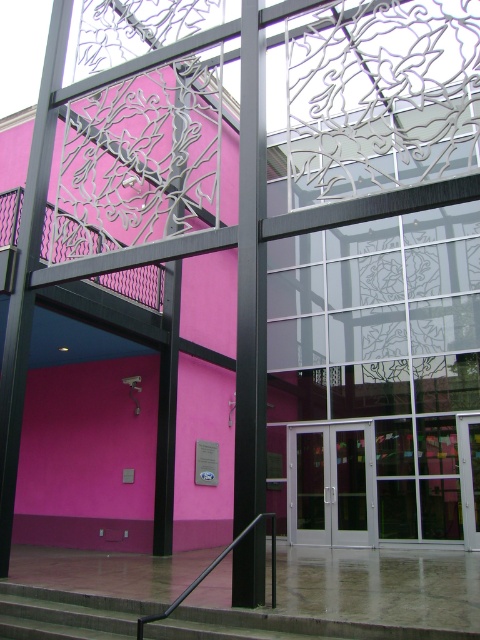
Question: Among these objects, which one is nearest to the camera?

Choices:
 (A) black metal/rail at lower center
 (B) concrete stairs at lower center
 (C) white glass door at center

Answer: (B)

Question: Is white glass door at center further to the viewer compared to black metal/rail at lower center?

Choices:
 (A) yes
 (B) no

Answer: (A)

Question: Among these objects, which one is farthest from the camera?

Choices:
 (A) white glass door at center
 (B) concrete stairs at lower center

Answer: (A)

Question: Observing the image, what is the correct spatial positioning of white glass door at center in reference to black metal/rail at lower center?

Choices:
 (A) right
 (B) left

Answer: (A)

Question: Which object is positioned farthest from the concrete stairs at lower center?

Choices:
 (A) white glass door at center
 (B) black metal/rail at lower center

Answer: (A)

Question: Observing the image, what is the correct spatial positioning of concrete stairs at lower center in reference to black metal/rail at lower center?

Choices:
 (A) left
 (B) right

Answer: (A)